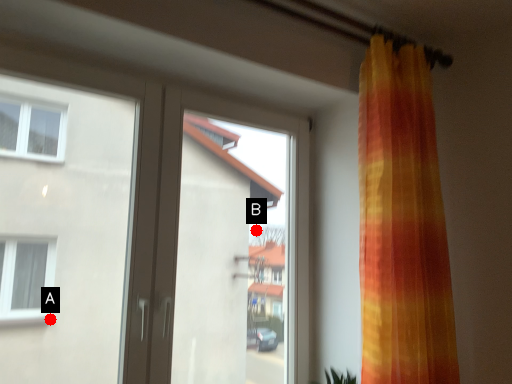
Question: Two points are circled on the image, labeled by A and B beside each circle. Which point is farther to the camera?

Choices:
 (A) A is further
 (B) B is further

Answer: (A)